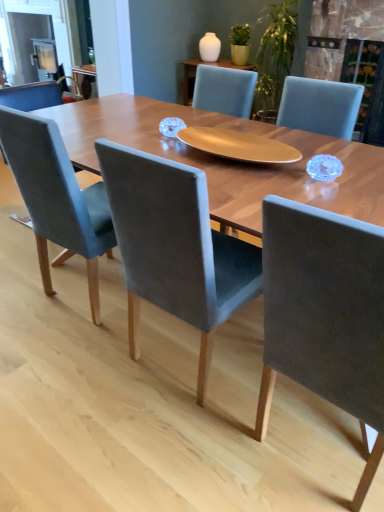
Locate an element on the screen. The width and height of the screenshot is (384, 512). vacant space underneath suede-like gray chair at center, the 1th chair in the right-to-left sequence (from a real-world perspective) is located at coordinates (313, 452).